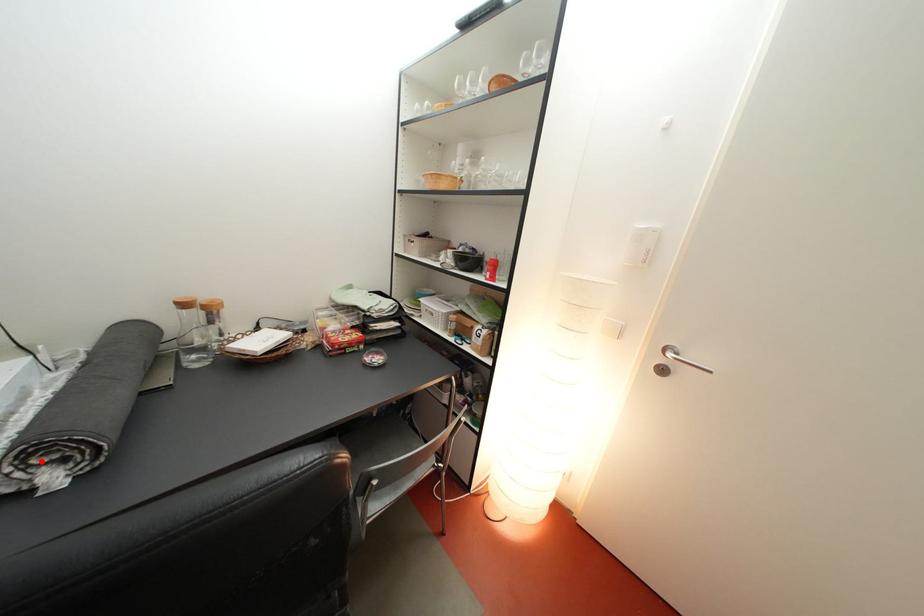
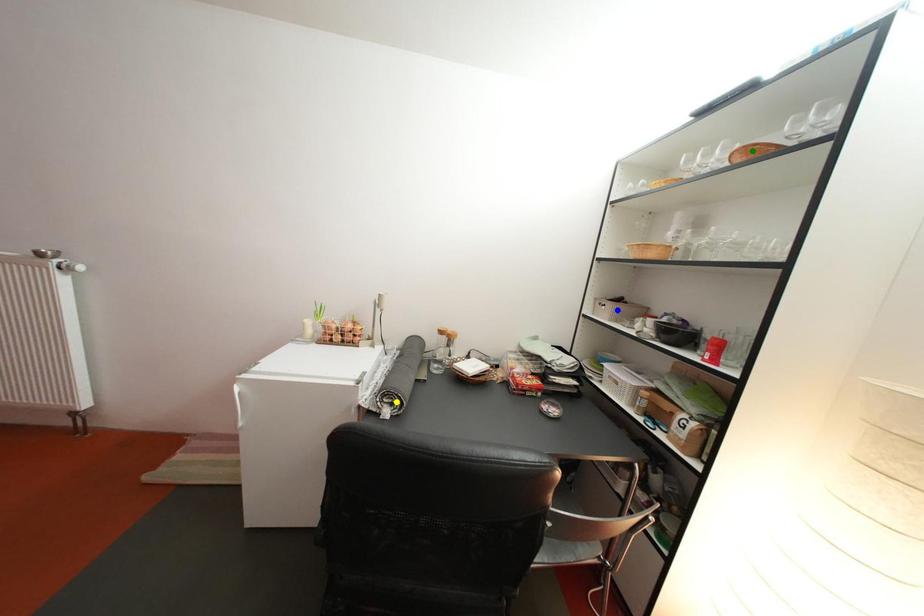
Question: I am providing you with two images of the same scene from different viewpoints. A red point is marked on the first image. You are given multiple points on the second image. In image 2, which mark is for the same physical point as the one in image 1?

Choices:
 (A) yellow point
 (B) blue point
 (C) green point

Answer: (A)